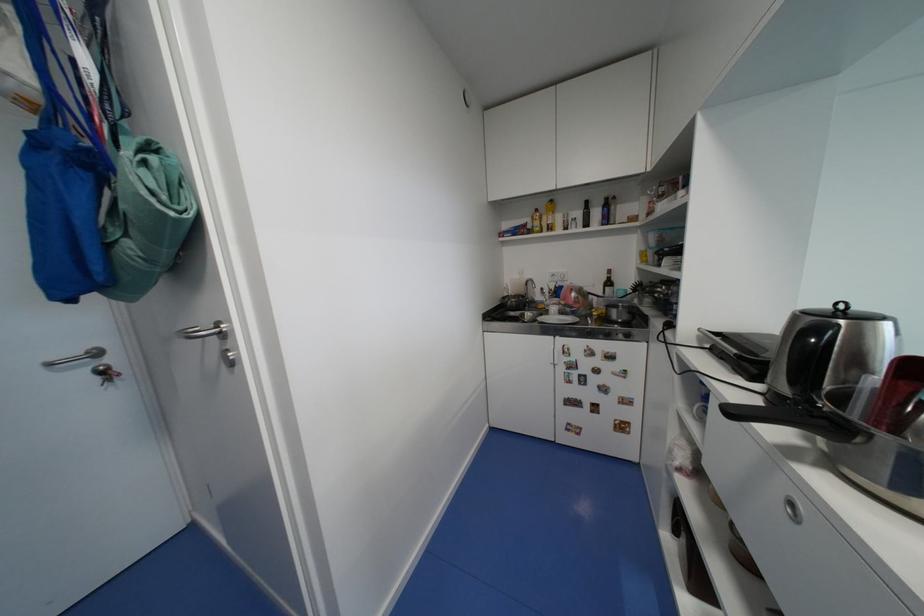
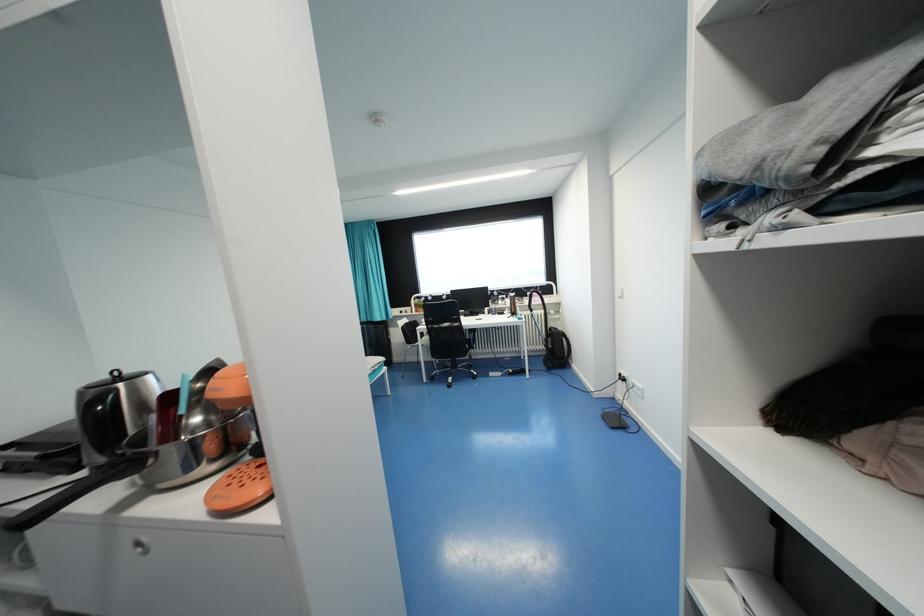
Question: The first image is from the beginning of the video and the second image is from the end. How did the camera likely rotate when shooting the video?

Choices:
 (A) Left
 (B) Right
 (C) Up
 (D) Down

Answer: (B)